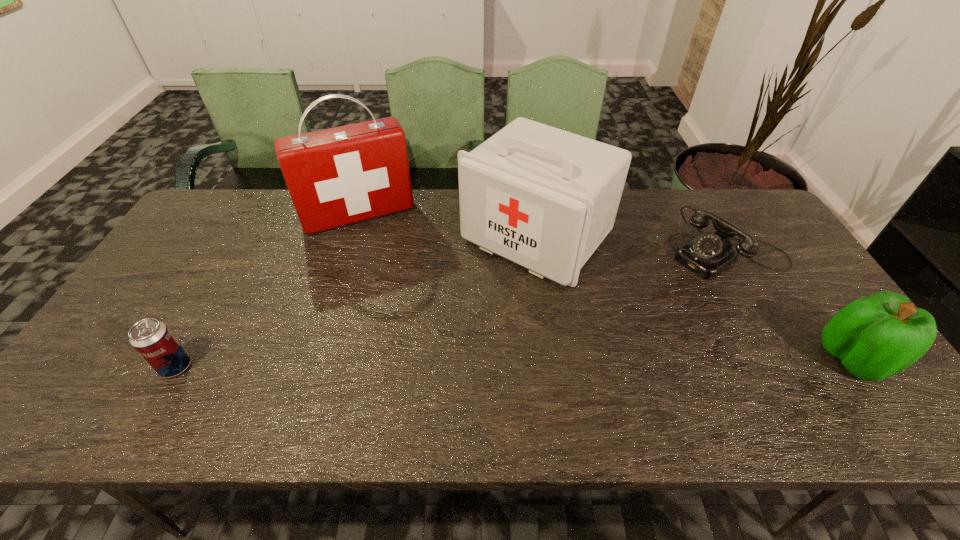
This screenshot has width=960, height=540. In order to click on bell pepper present at the right edge in this screenshot , I will do `click(875, 337)`.

Find the location of a particular element. The image size is (960, 540). telephone that is at the right edge is located at coordinates (708, 254).

The height and width of the screenshot is (540, 960). I want to click on object situated at the far right corner, so click(x=708, y=254).

Where is `object that is at the near right corner`? object that is at the near right corner is located at coordinates (875, 337).

In order to click on vacant region at the far edge of the desktop in this screenshot , I will do `click(442, 215)`.

Locate an element on the screen. vacant space at the near edge is located at coordinates (795, 370).

What are the coordinates of `vacant space at the left edge of the desktop` in the screenshot? It's located at (191, 278).

Find the location of a particular element. This screenshot has height=540, width=960. vacant point at the right edge is located at coordinates (795, 304).

Where is `free space between the third shortest object and the beer can`? free space between the third shortest object and the beer can is located at coordinates (515, 362).

At what (x,y) coordinates should I click in order to perform the action: click on free space between the fourth object from right to left and the third object from right to left. Please return your answer as a coordinate pair (x, y). Looking at the image, I should click on (447, 226).